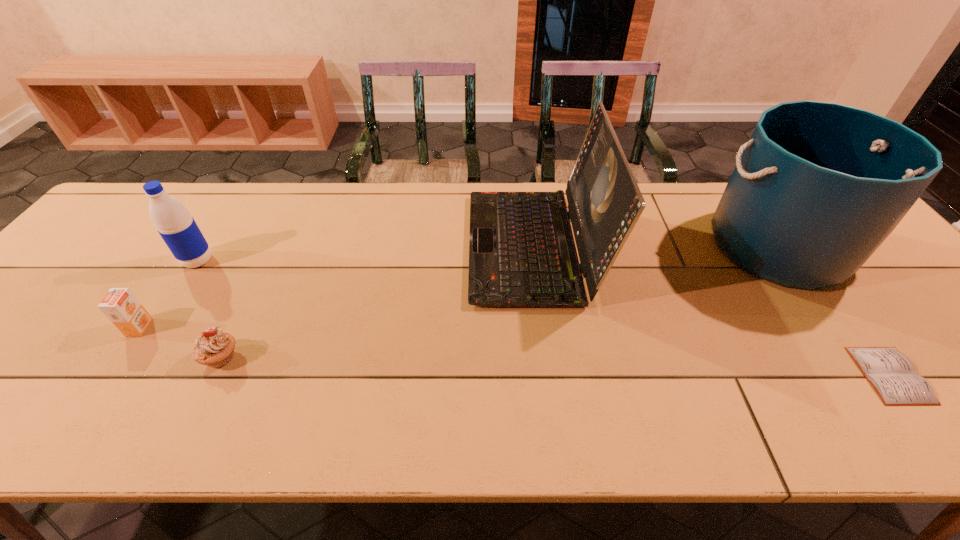
Locate an element on the screen. bucket is located at coordinates (819, 186).

I want to click on laptop computer, so click(522, 253).

You are a GUI agent. You are given a task and a screenshot of the screen. Output one action in this format:
    pyautogui.click(x=<x>, y=<y>)
    Task: Click on the water bottle
    The width and height of the screenshot is (960, 540).
    Given the screenshot: What is the action you would take?
    pyautogui.click(x=178, y=229)

Locate an element on the screen. orange juice is located at coordinates (122, 308).

At what (x,y) coordinates should I click in order to perform the action: click on the third shortest object. Please return your answer as a coordinate pair (x, y). The image size is (960, 540). Looking at the image, I should click on (122, 308).

Identify the location of cupcake. (214, 348).

Where is `the fifth tallest object`? The width and height of the screenshot is (960, 540). the fifth tallest object is located at coordinates (214, 348).

This screenshot has width=960, height=540. I want to click on diary, so click(x=892, y=374).

Find the location of a particular element. blank space located 0.130m on the front of the bucket is located at coordinates pyautogui.click(x=843, y=339).

I want to click on vacant region located on the screen of the laptop computer, so click(x=335, y=246).